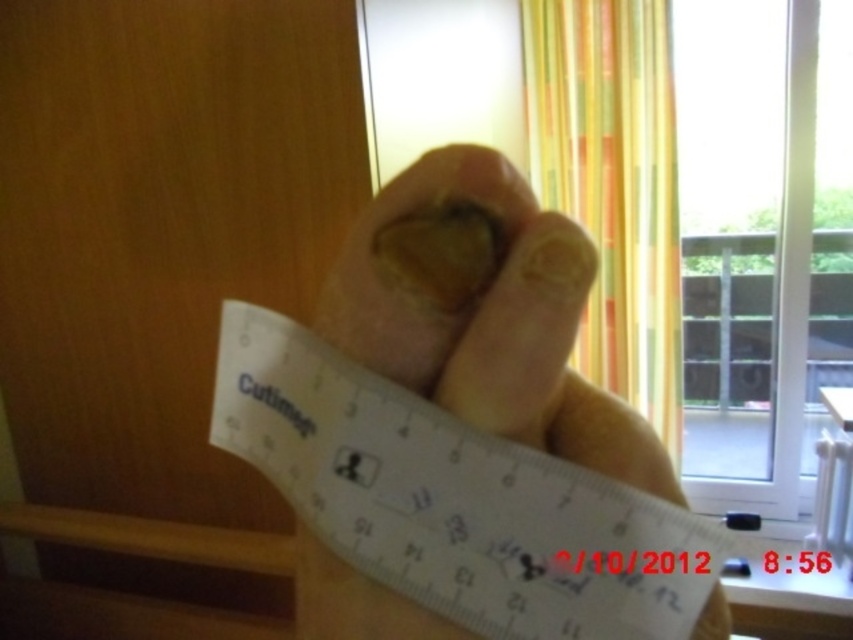
Question: Among these points, which one is nearest to the camera?

Choices:
 (A) (664, 339)
 (B) (416, 432)

Answer: (B)

Question: Does transparent plastic ruler at center have a lesser width compared to yellow striped curtain at upper center?

Choices:
 (A) no
 (B) yes

Answer: (B)

Question: Among these objects, which one is nearest to the camera?

Choices:
 (A) yellow striped curtain at upper center
 (B) transparent plastic ruler at center

Answer: (B)

Question: Is transparent plastic ruler at center thinner than yellow striped curtain at upper center?

Choices:
 (A) yes
 (B) no

Answer: (A)

Question: Is transparent plastic ruler at center to the left of yellow striped curtain at upper center from the viewer's perspective?

Choices:
 (A) yes
 (B) no

Answer: (A)